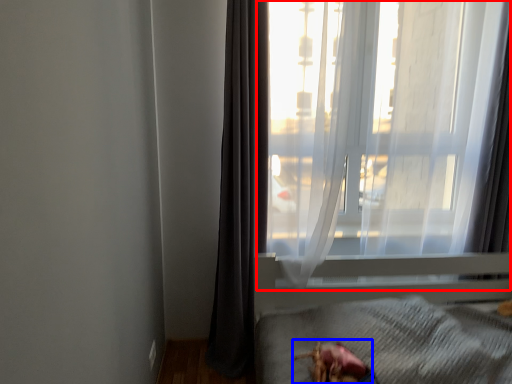
Question: Among these objects, which one is nearest to the camera, window (highlighted by a red box) or animal (highlighted by a blue box)?

Choices:
 (A) window
 (B) animal

Answer: (B)